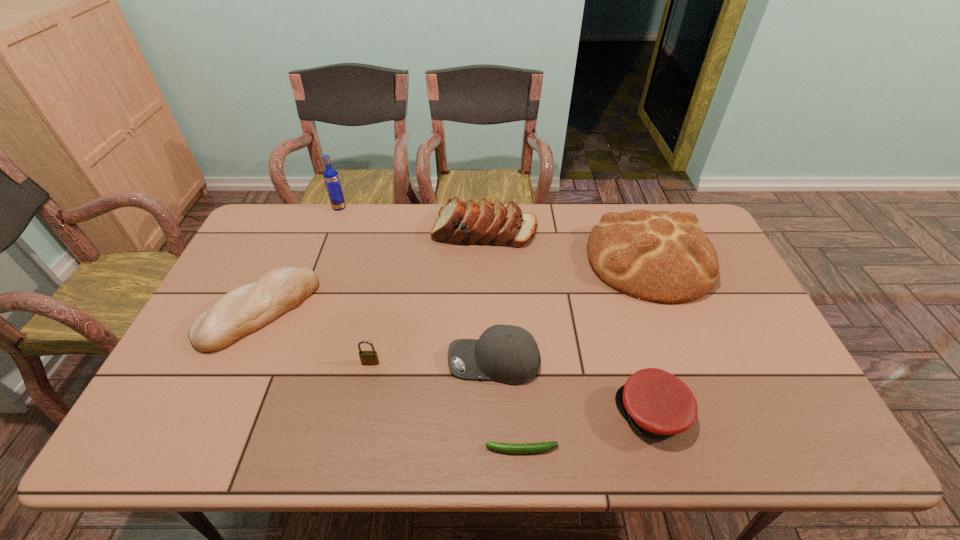
Find the location of `vacant area at the far edge of the desktop`. vacant area at the far edge of the desktop is located at coordinates (568, 240).

Identify the location of vacant space at the near edge. (492, 434).

What are the coordinates of `free location at the left edge` in the screenshot? It's located at (x=189, y=393).

Where is `free space at the far left corner of the desktop`? The height and width of the screenshot is (540, 960). free space at the far left corner of the desktop is located at coordinates [301, 213].

In the image, there is a desktop. Identify the location of vacant space at the near right corner. The image size is (960, 540). [788, 439].

Where is `empty space that is in between the baseball cap and the shortest object`? The width and height of the screenshot is (960, 540). empty space that is in between the baseball cap and the shortest object is located at coordinates (508, 406).

This screenshot has width=960, height=540. Identify the location of vacant area between the second bread from left to right and the second tallest object. (566, 245).

In order to click on free area in between the sixth object from right to left and the baseball cap in this screenshot , I will do pos(432,362).

You are a GUI agent. You are given a task and a screenshot of the screen. Output one action in this format:
    pyautogui.click(x=<x>, y=<y>)
    Task: Click on the vacant area that lies between the zucchini and the leftmost bread
    The height and width of the screenshot is (540, 960).
    Given the screenshot: What is the action you would take?
    pyautogui.click(x=391, y=380)

This screenshot has height=540, width=960. Find the location of `free area in between the padlock and the rightmost bread`. free area in between the padlock and the rightmost bread is located at coordinates (510, 310).